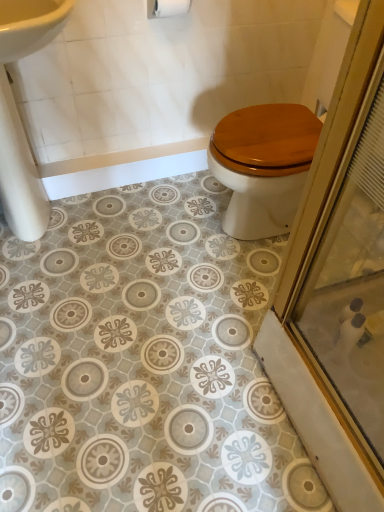
Question: From a real-world perspective, is white matte toilet paper at upper center physically located above or below white glossy sink at upper left?

Choices:
 (A) above
 (B) below

Answer: (A)

Question: Considering the positions of white matte toilet paper at upper center and white glossy sink at upper left in the image, is white matte toilet paper at upper center wider or thinner than white glossy sink at upper left?

Choices:
 (A) thin
 (B) wide

Answer: (A)

Question: From the image's perspective, is white matte toilet paper at upper center positioned above or below white glossy sink at upper left?

Choices:
 (A) above
 (B) below

Answer: (A)

Question: Based on their positions, is white glossy sink at upper left located to the left or right of white matte toilet paper at upper center?

Choices:
 (A) right
 (B) left

Answer: (B)

Question: In terms of height, does white glossy sink at upper left look taller or shorter compared to white matte toilet paper at upper center?

Choices:
 (A) short
 (B) tall

Answer: (B)

Question: Relative to white matte toilet paper at upper center, is white glossy sink at upper left in front or behind?

Choices:
 (A) behind
 (B) front

Answer: (B)

Question: From the image's perspective, is white glossy sink at upper left located above or below white matte toilet paper at upper center?

Choices:
 (A) above
 (B) below

Answer: (B)